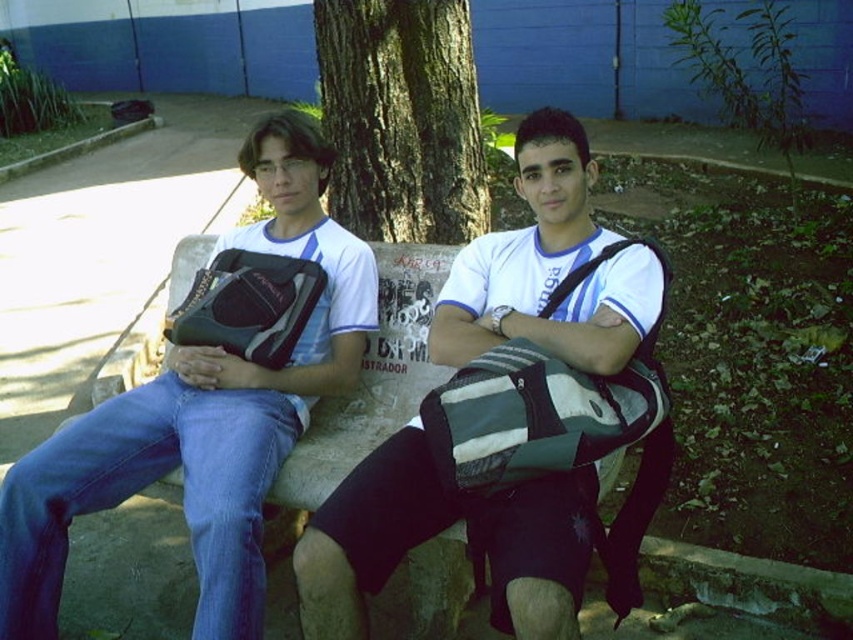
Question: Observing the image, what is the correct spatial positioning of matte black backpack at center in reference to matte black bag at left?

Choices:
 (A) left
 (B) right

Answer: (B)

Question: In this image, where is matte black backpack at center located relative to matte black bag at left?

Choices:
 (A) below
 (B) above

Answer: (A)

Question: Which point is farther to the camera?

Choices:
 (A) (227, 372)
 (B) (448, 276)

Answer: (B)

Question: Which point is farther from the camera taking this photo?

Choices:
 (A) (397, 29)
 (B) (448, 298)

Answer: (A)

Question: Does matte black backpack at center have a lesser width compared to matte black bag at left?

Choices:
 (A) yes
 (B) no

Answer: (A)

Question: Estimate the real-world distances between objects in this image. Which object is farther from the green rough bark tree at center?

Choices:
 (A) matte black bag at left
 (B) matte black backpack at center

Answer: (B)